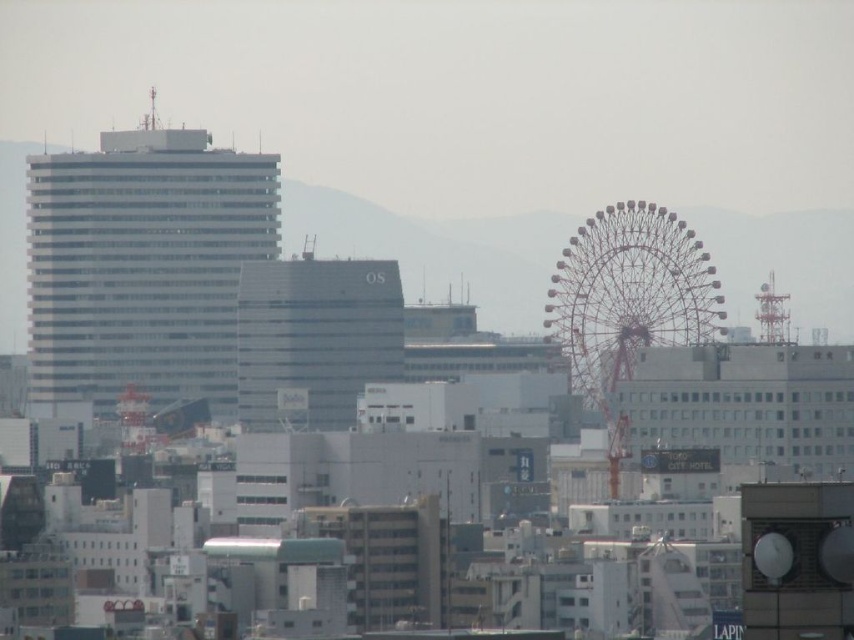
You are a city planner assessing the skyline. Which object occupies more horizontal space in the image between the white glass building at left and the metallic silver ferris wheel at right?

The white glass building at left has a greater width than the metallic silver ferris wheel at right, so it occupies more horizontal space.

You are standing in the city and want to take a photo of both the white glass building at left and the metallic silver ferris wheel at right. If your camera can capture objects within a 100 meter range, will both be in the same frame?

The white glass building at left is 80.10 meters away from the metallic silver ferris wheel at right. Since the distance between them is less than 100 meters, both objects will be within the camera range and can be captured in the same frame.

You are standing at the origin point of the city map. You need to locate the white glass building at left. What are its coordinates?

The white glass building at left is located at coordinates point (143,266).